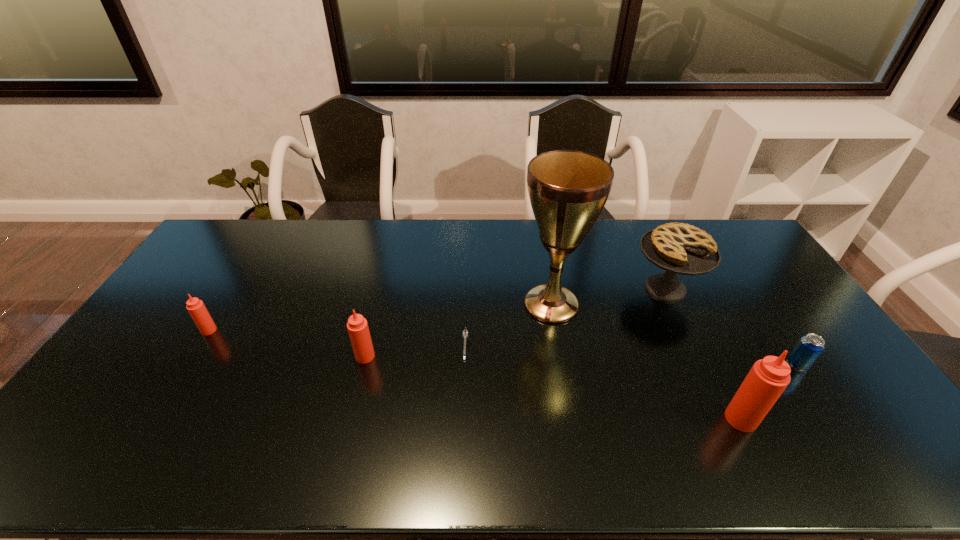
I want to click on Tabasco sauce that is the second closest to the rightmost Tabasco sauce, so click(x=196, y=308).

The image size is (960, 540). Find the location of `free space that satisfies the following two spatial constraints: 1. on the back side of the rightmost Tabasco sauce; 2. on the right side of the second shortest object`. free space that satisfies the following two spatial constraints: 1. on the back side of the rightmost Tabasco sauce; 2. on the right side of the second shortest object is located at coordinates (714, 364).

Identify the location of free space in the image that satisfies the following two spatial constraints: 1. on the front side of the second shortest Tabasco sauce; 2. on the right side of the beer can. pos(363,364).

The width and height of the screenshot is (960, 540). Identify the location of vacant space that satisfies the following two spatial constraints: 1. on the cut side of the rightmost object; 2. on the left side of the pie. (701, 364).